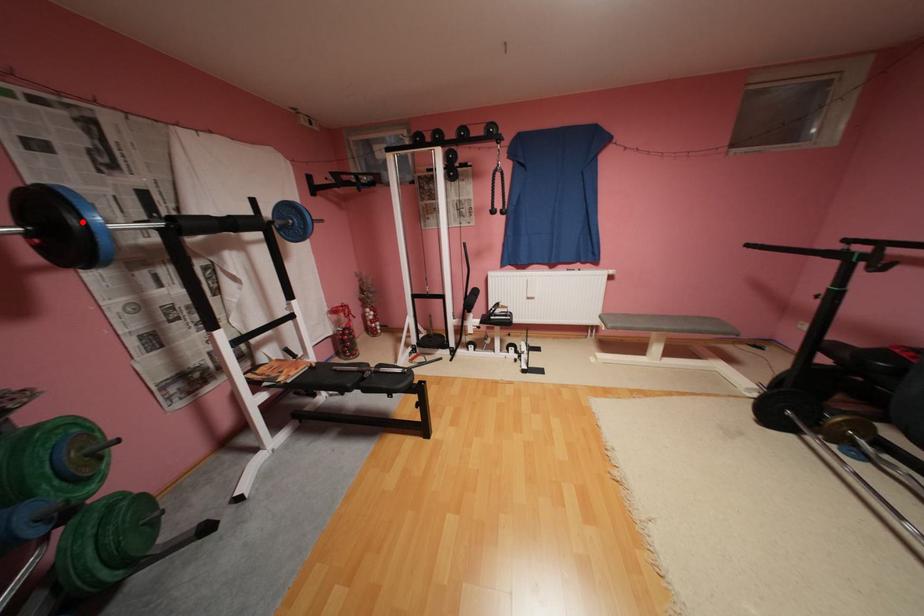
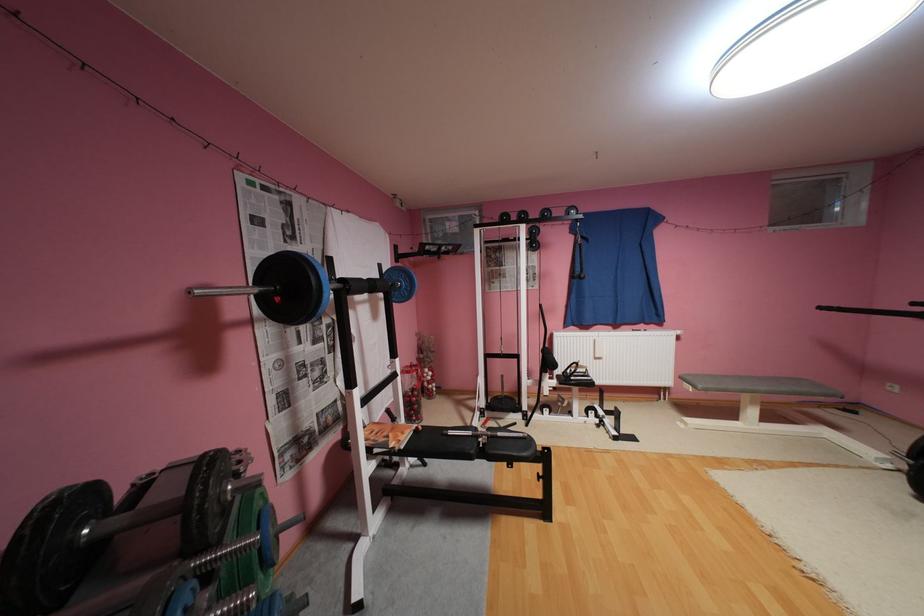
The point at the highlighted location is marked in the first image. Where is the corresponding point in the second image?

(322, 283)